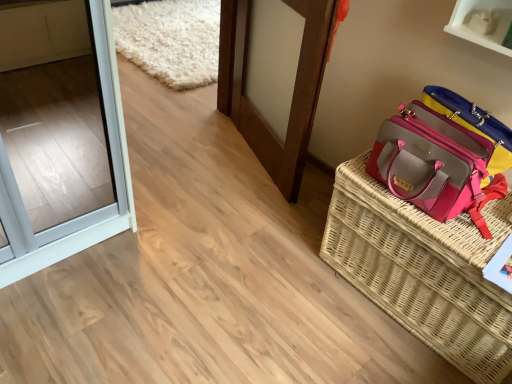
Question: Is pink fabric handbag at right not near brown wooden door at center?

Choices:
 (A) yes
 (B) no

Answer: (B)

Question: From a real-world perspective, is pink fabric handbag at right over brown wooden door at center?

Choices:
 (A) no
 (B) yes

Answer: (B)

Question: Can you confirm if pink fabric handbag at right is positioned to the right of brown wooden door at center?

Choices:
 (A) yes
 (B) no

Answer: (A)

Question: Is pink fabric handbag at right shorter than brown wooden door at center?

Choices:
 (A) no
 (B) yes

Answer: (B)

Question: Can you confirm if pink fabric handbag at right is positioned to the left of brown wooden door at center?

Choices:
 (A) yes
 (B) no

Answer: (B)

Question: Does pink fabric handbag at right have a lesser width compared to brown wooden door at center?

Choices:
 (A) yes
 (B) no

Answer: (B)

Question: Can you see pink woven picnic basket at right touching pink fabric handbag at right?

Choices:
 (A) no
 (B) yes

Answer: (A)

Question: From the image's perspective, would you say pink woven picnic basket at right is shown under pink fabric handbag at right?

Choices:
 (A) yes
 (B) no

Answer: (A)

Question: Can you confirm if pink woven picnic basket at right is shorter than pink fabric handbag at right?

Choices:
 (A) no
 (B) yes

Answer: (A)

Question: Considering the relative sizes of pink woven picnic basket at right and pink fabric handbag at right in the image provided, is pink woven picnic basket at right thinner than pink fabric handbag at right?

Choices:
 (A) yes
 (B) no

Answer: (B)

Question: From a real-world perspective, is pink woven picnic basket at right located higher than pink fabric handbag at right?

Choices:
 (A) no
 (B) yes

Answer: (A)

Question: Would you consider pink woven picnic basket at right to be distant from pink fabric handbag at right?

Choices:
 (A) yes
 (B) no

Answer: (B)

Question: Is the depth of pink fabric handbag at right less than that of pink woven picnic basket at right?

Choices:
 (A) yes
 (B) no

Answer: (B)